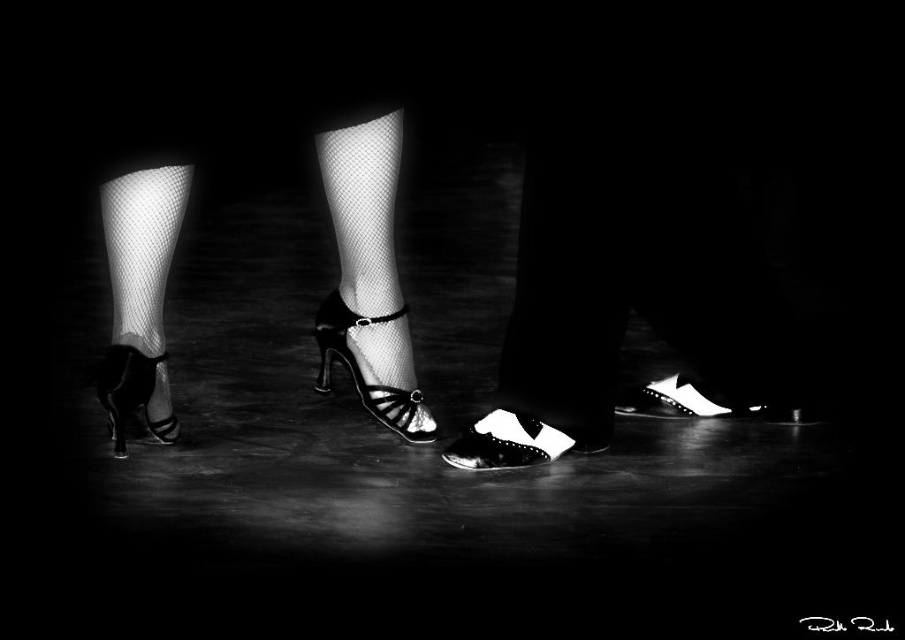
Who is taller, white leather shoe at center or white leather shoe at lower right?

white leather shoe at center

Who is higher up, white leather shoe at center or white leather shoe at lower right?

white leather shoe at center

The width and height of the screenshot is (905, 640). What do you see at coordinates (637, 285) in the screenshot?
I see `white leather shoe at center` at bounding box center [637, 285].

Identify the location of white leather shoe at center. The width and height of the screenshot is (905, 640). (637, 285).

Who is positioned more to the left, shiny black leather shoe at center or white leather shoe at lower right?

shiny black leather shoe at center is more to the left.

Does point (483, 426) come farther from viewer compared to point (742, 410)?

That is False.

Does point (603, 440) come farther from viewer compared to point (707, 413)?

No, it is not.

Find the location of a particular element. shiny black leather shoe at center is located at coordinates (519, 442).

You are a GUI agent. You are given a task and a screenshot of the screen. Output one action in this format:
    pyautogui.click(x=<x>, y=<y>)
    Task: Click on the shiny black leather shoe at center
    This screenshot has height=640, width=905.
    Given the screenshot: What is the action you would take?
    pyautogui.click(x=519, y=442)

Who is more distant from viewer, (x=486, y=467) or (x=113, y=369)?

Point (x=486, y=467)

In order to click on shiny black leather shoe at center in this screenshot , I will do `click(519, 442)`.